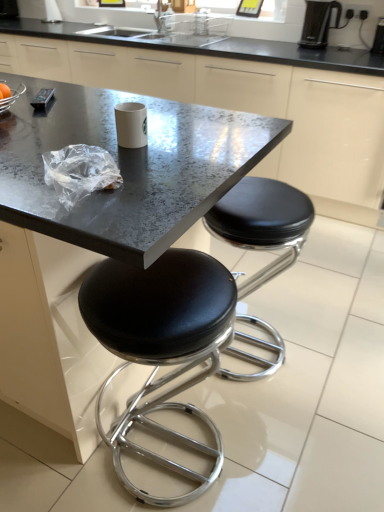
Question: From the image's perspective, is black granite countertop at center located above or below black leather stool at center, acting as the 2th stool starting from the left?

Choices:
 (A) above
 (B) below

Answer: (A)

Question: Does point (309, 96) appear closer or farther from the camera than point (278, 202)?

Choices:
 (A) farther
 (B) closer

Answer: (A)

Question: Which object is positioned closest to the black plastic coffee machine at upper right?

Choices:
 (A) metallic gray table at center
 (B) white glossy paper cup at center
 (C) black granite countertop at center
 (D) black plastic coffee maker at upper right
 (E) black leather stool at lower center, the second stool viewed from the right

Answer: (D)

Question: Considering the real-world distances, which object is farthest from the black plastic coffee maker at upper right?

Choices:
 (A) white glossy paper cup at center
 (B) black plastic coffee machine at upper right
 (C) black leather stool at center, which is counted as the 1th stool, starting from the right
 (D) black leather stool at lower center, the 1th stool in the left-to-right sequence
 (E) metallic gray table at center

Answer: (D)